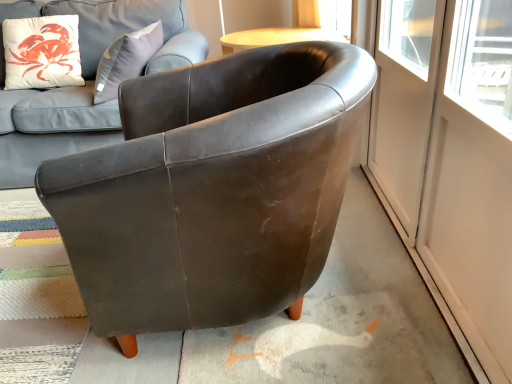
Question: Does matte brown leather couch at upper left turn towards transparent glass screen door at right, which is counted as the 1th screen door, starting from the right?

Choices:
 (A) yes
 (B) no

Answer: (B)

Question: Considering the relative sizes of matte brown leather couch at upper left and transparent glass screen door at right, which is the second screen door from left to right, in the image provided, is matte brown leather couch at upper left shorter than transparent glass screen door at right, which is the second screen door from left to right,?

Choices:
 (A) no
 (B) yes

Answer: (A)

Question: Does matte brown leather couch at upper left appear on the left side of transparent glass screen door at right, which is counted as the 1th screen door, starting from the right?

Choices:
 (A) no
 (B) yes

Answer: (B)

Question: Is matte brown leather couch at upper left outside transparent glass screen door at right, which is the second screen door from left to right?

Choices:
 (A) no
 (B) yes

Answer: (B)

Question: From the image's perspective, is matte brown leather couch at upper left beneath transparent glass screen door at right, which is the second screen door from left to right?

Choices:
 (A) yes
 (B) no

Answer: (B)

Question: Is matte brown leather couch at upper left wider than transparent glass screen door at right, which is the second screen door from left to right?

Choices:
 (A) yes
 (B) no

Answer: (A)

Question: Is transparent glass screen door at right, marked as the first screen door in a left-to-right arrangement, smaller than brown leather armchair at center?

Choices:
 (A) yes
 (B) no

Answer: (A)

Question: Is brown leather armchair at center a part of transparent glass screen door at right, marked as the first screen door in a left-to-right arrangement?

Choices:
 (A) yes
 (B) no

Answer: (B)

Question: Is transparent glass screen door at right, marked as the first screen door in a left-to-right arrangement, at the left side of brown leather armchair at center?

Choices:
 (A) yes
 (B) no

Answer: (B)

Question: Is transparent glass screen door at right, marked as the first screen door in a left-to-right arrangement, in contact with brown leather armchair at center?

Choices:
 (A) yes
 (B) no

Answer: (B)

Question: From a real-world perspective, is transparent glass screen door at right, which is the 2th screen door from right to left, physically above brown leather armchair at center?

Choices:
 (A) no
 (B) yes

Answer: (B)

Question: Is transparent glass screen door at right, which is the 2th screen door from right to left, located outside brown leather armchair at center?

Choices:
 (A) yes
 (B) no

Answer: (A)

Question: Can brown leather armchair at center be found inside matte brown leather couch at upper left?

Choices:
 (A) yes
 (B) no

Answer: (B)